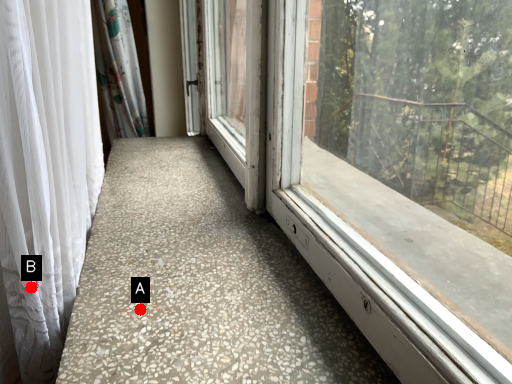
Question: Two points are circled on the image, labeled by A and B beside each circle. Which point is farther from the camera taking this photo?

Choices:
 (A) A is further
 (B) B is further

Answer: (A)